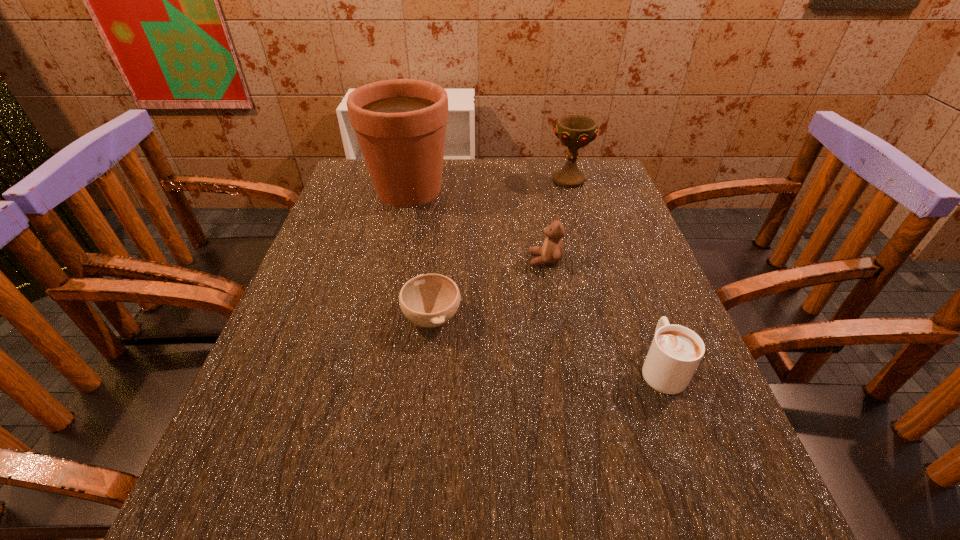
Image resolution: width=960 pixels, height=540 pixels. I want to click on object located in the far left corner section of the desktop, so click(400, 124).

Where is `object located in the far right corner section of the desktop`? object located in the far right corner section of the desktop is located at coordinates (574, 131).

Where is `vacant space at the far edge of the desktop`? The height and width of the screenshot is (540, 960). vacant space at the far edge of the desktop is located at coordinates (502, 170).

Find the location of a particular element. The height and width of the screenshot is (540, 960). vacant space at the left edge is located at coordinates (305, 409).

The height and width of the screenshot is (540, 960). I want to click on vacant space at the right edge of the desktop, so click(672, 438).

Find the location of a particular element. The width and height of the screenshot is (960, 540). free space at the far right corner is located at coordinates (598, 180).

Locate an element on the screen. This screenshot has height=540, width=960. free space between the shortest object and the tallest object is located at coordinates (420, 254).

Locate an element on the screen. free space between the tallest object and the teddy bear is located at coordinates (477, 225).

Locate an element on the screen. vacant region between the tallest object and the chalice is located at coordinates (489, 185).

Locate an element on the screen. vacant area that lies between the fourth tallest object and the teddy bear is located at coordinates (603, 313).